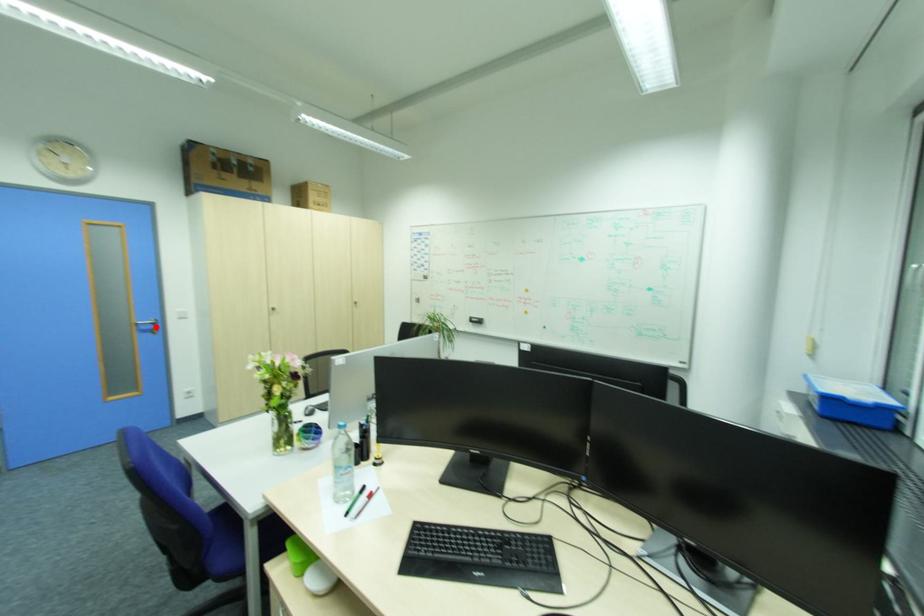
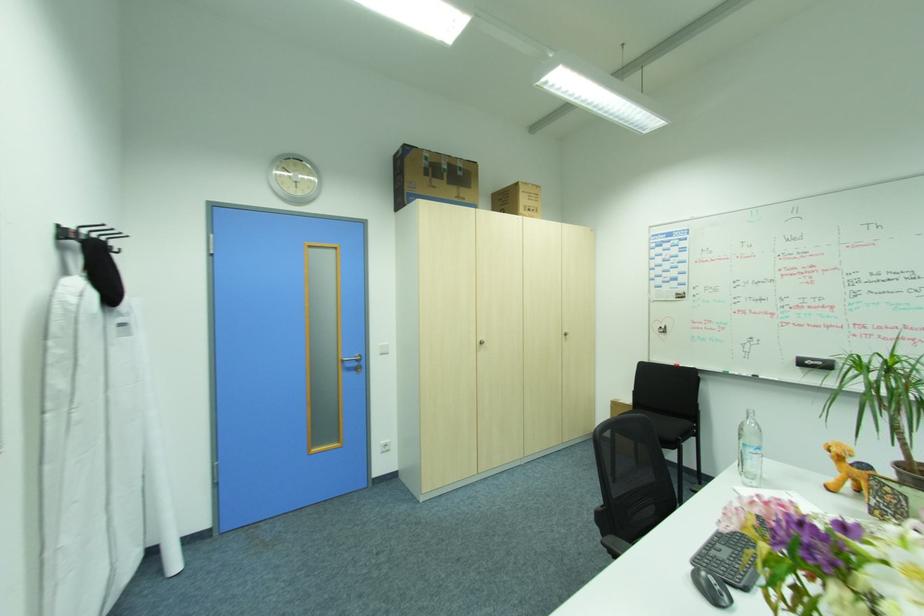
In the second image, find the point that corresponds to the highlighted location in the first image.

(360, 363)